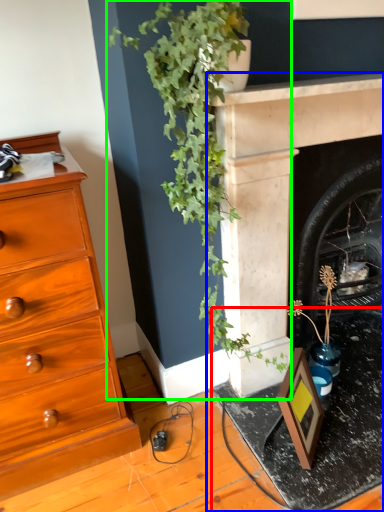
Question: Which object is the farthest from table (highlighted by a red box)? Choose among these: fireplace (highlighted by a blue box) or houseplant (highlighted by a green box).

Choices:
 (A) fireplace
 (B) houseplant

Answer: (B)